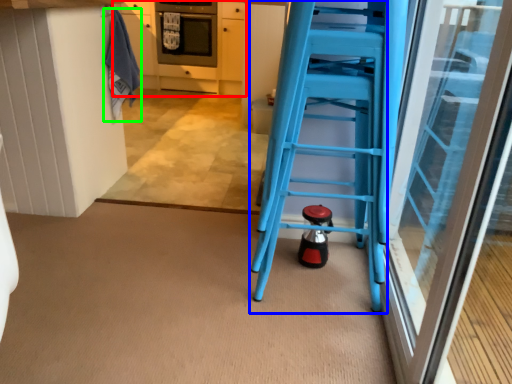
Question: Considering the real-world distances, which object is closest to cabinetry (highlighted by a red box)? ladder (highlighted by a blue box) or laundry (highlighted by a green box).

Choices:
 (A) ladder
 (B) laundry

Answer: (B)